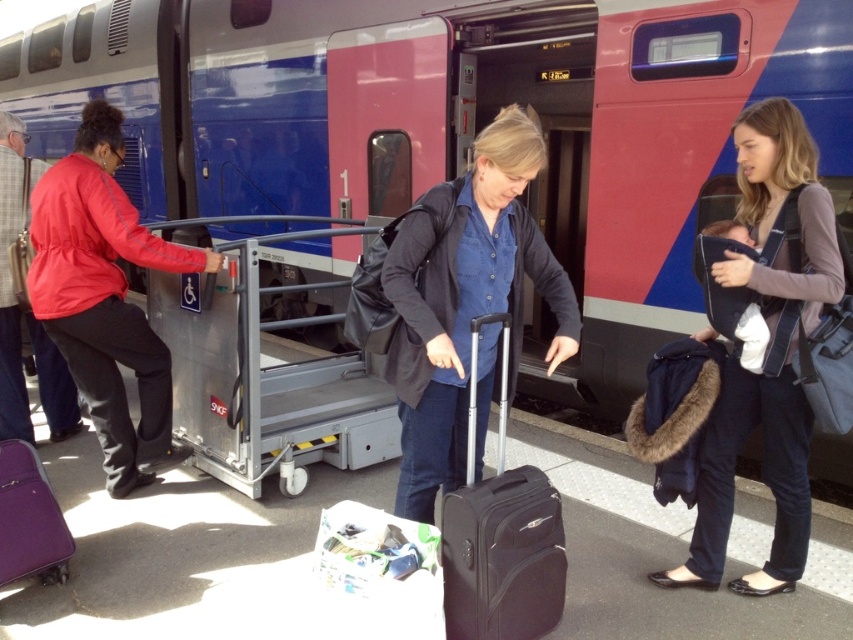
Question: Which point is farther to the camera?

Choices:
 (A) dark blue jeans at center
 (B) black hardshell suitcase at center
 (C) matte purple suitcase at lower left

Answer: (C)

Question: Which object is positioned closest to the denim shirt at center?

Choices:
 (A) dark blue jeans at center
 (B) matte purple suitcase at lower left

Answer: (A)

Question: Observing the image, what is the correct spatial positioning of dark blue jeans at center in reference to black hardshell suitcase at center?

Choices:
 (A) right
 (B) left

Answer: (A)

Question: Which object is the farthest from the black hardshell suitcase at center?

Choices:
 (A) red fabric jacket at left
 (B) denim shirt at center
 (C) dark blue jeans at center
 (D) matte purple suitcase at lower left

Answer: (A)

Question: Can you confirm if dark blue jeans at center is bigger than black hardshell suitcase at center?

Choices:
 (A) yes
 (B) no

Answer: (A)

Question: Is denim shirt at center wider than red fabric jacket at left?

Choices:
 (A) no
 (B) yes

Answer: (A)